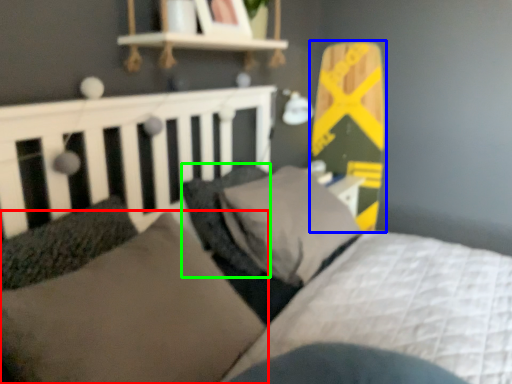
Question: Based on their relative distances, which object is nearer to pillow (highlighted by a red box)? Choose from skateboard (highlighted by a blue box) and pillow (highlighted by a green box).

Choices:
 (A) skateboard
 (B) pillow

Answer: (B)